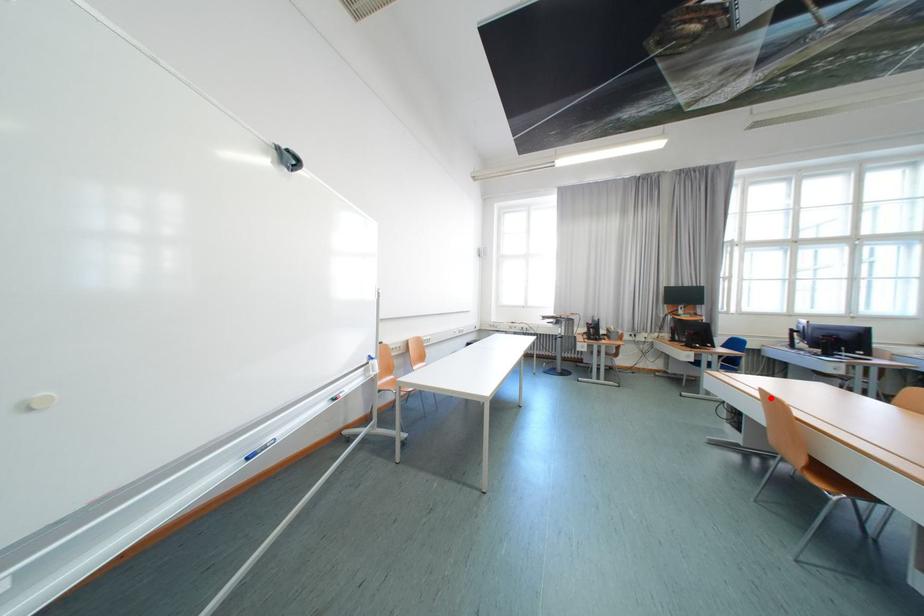
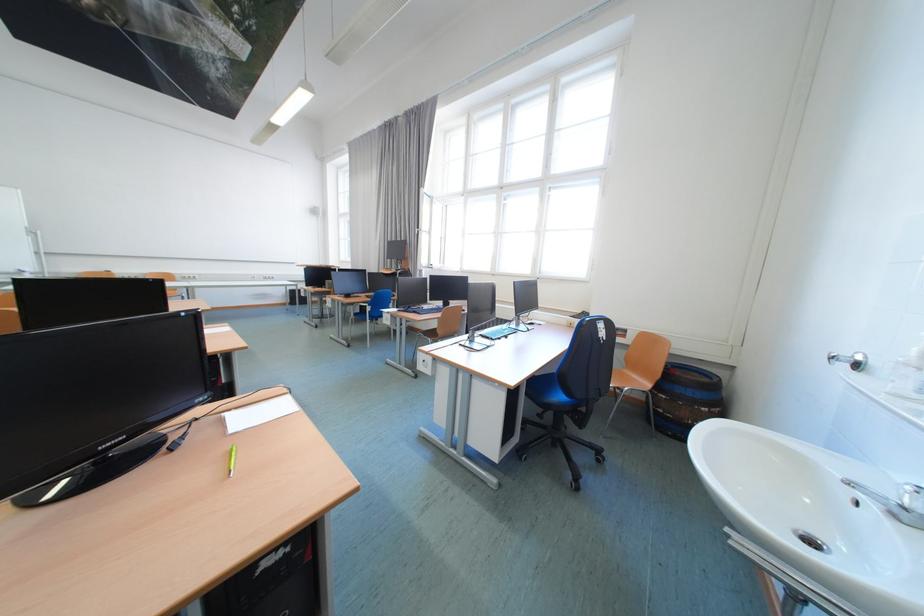
Question: I am providing you with two images of the same scene from different viewpoints. A red point is marked on the first image. Can you still see the location of the red point in image 2?

Choices:
 (A) Yes
 (B) No

Answer: (B)